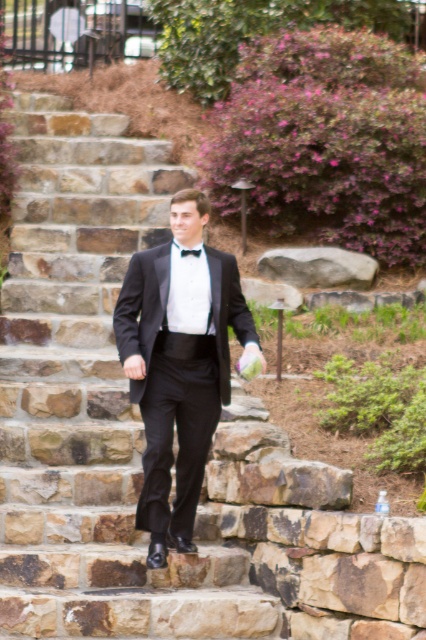
Question: Which of the following is the closest to the observer?

Choices:
 (A) (221, 628)
 (B) (256, 342)

Answer: (A)

Question: Which object is closer to the camera taking this photo?

Choices:
 (A) black satin bow tie at center
 (B) black satin tuxedo at center

Answer: (B)

Question: Which of these objects is positioned closest to the smooth stone stairs at center?

Choices:
 (A) black satin bow tie at center
 (B) black satin tuxedo at center

Answer: (A)

Question: Observing the image, what is the correct spatial positioning of smooth stone stairs at center in reference to black satin bow tie at center?

Choices:
 (A) left
 (B) right

Answer: (A)

Question: Does black satin tuxedo at center have a smaller size compared to black satin bow tie at center?

Choices:
 (A) yes
 (B) no

Answer: (B)

Question: Can you confirm if smooth stone stairs at center is smaller than black satin tuxedo at center?

Choices:
 (A) yes
 (B) no

Answer: (A)